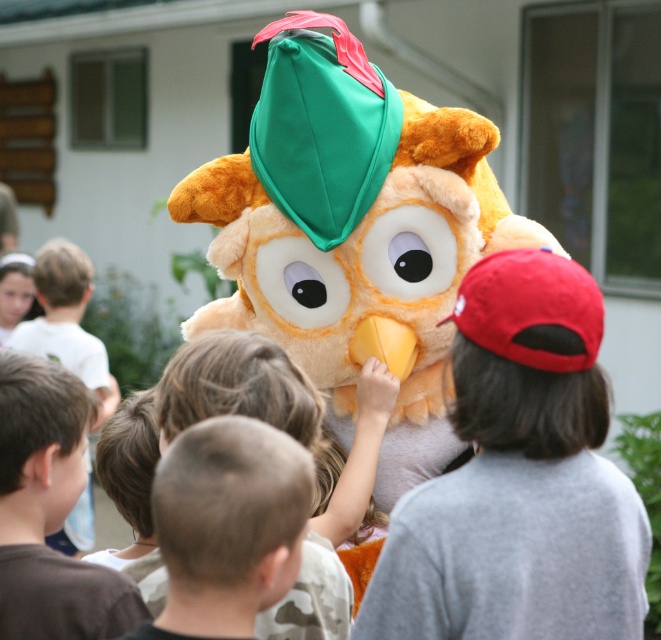
Can you confirm if fluffy orange owl at center is positioned to the left of red fabric cap at center?

Yes, fluffy orange owl at center is to the left of red fabric cap at center.

Between point (403, 260) and point (490, 376), which one is positioned in front?

Point (490, 376) is more forward.

Is point (260, 106) positioned in front of point (617, 605)?

That is False.

The width and height of the screenshot is (661, 640). I want to click on fluffy orange owl at center, so click(x=352, y=230).

Who is lower down, fluffy orange owl at center or light brown hair at upper left?

light brown hair at upper left is lower down.

Does point (282, 60) come closer to viewer compared to point (91, 484)?

Yes.

Is point (430, 186) in front of point (54, 259)?

Yes, point (430, 186) is closer to viewer.

Where is `fluffy orange owl at center`? Image resolution: width=661 pixels, height=640 pixels. fluffy orange owl at center is located at coordinates point(352,230).

Can you confirm if red fabric cap at center is taller than light brown hair at upper left?

No.

Is red fabric cap at center bigger than light brown hair at upper left?

No.

Does point (635, 499) lie behind point (48, 305)?

No, it is not.

You are a GUI agent. You are given a task and a screenshot of the screen. Output one action in this format:
    pyautogui.click(x=<x>, y=<y>)
    Task: Click on the red fabric cap at center
    
    Given the screenshot: What is the action you would take?
    pyautogui.click(x=520, y=477)